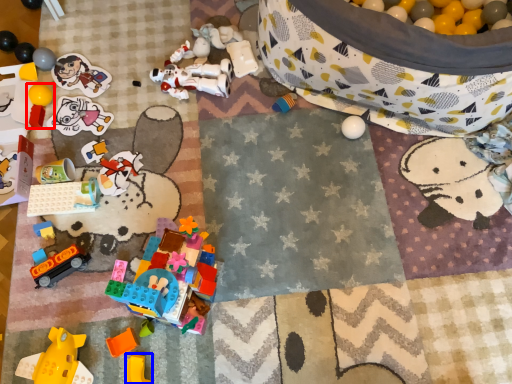
Question: Which object is further to the camera taking this photo, toy (highlighted by a red box) or toy (highlighted by a blue box)?

Choices:
 (A) toy
 (B) toy

Answer: (A)